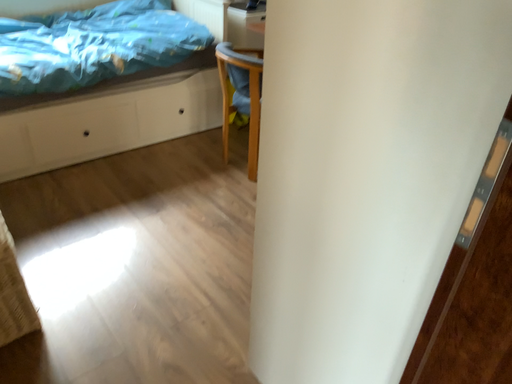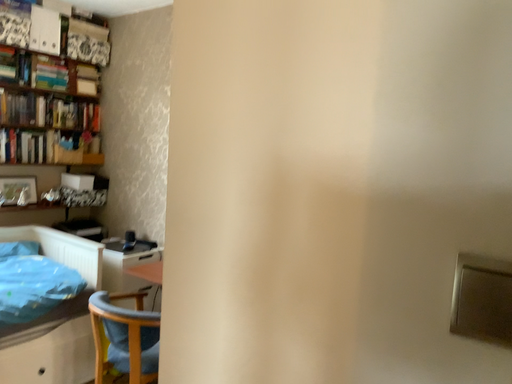
Question: How did the camera likely rotate when shooting the video?

Choices:
 (A) rotated right
 (B) rotated left

Answer: (A)